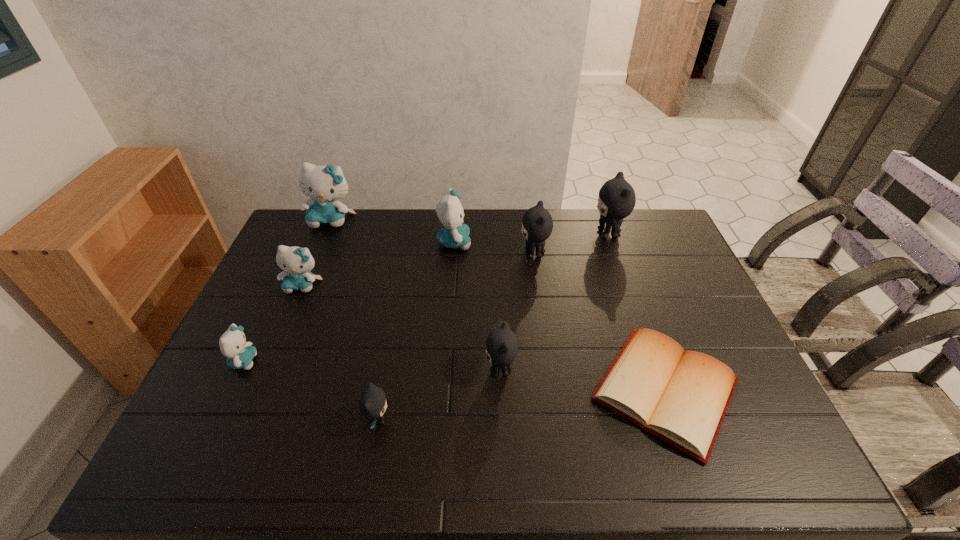
Locate an element on the screen. free spot that satisfies the following two spatial constraints: 1. on the front-facing side of the rightmost gray kitten; 2. on the face of the fourth nearest kitten is located at coordinates (626, 286).

Find the location of `vacant space that satisfies the following two spatial constraints: 1. on the face of the second nearest blue kitten; 2. on the face of the nearest blue kitten`. vacant space that satisfies the following two spatial constraints: 1. on the face of the second nearest blue kitten; 2. on the face of the nearest blue kitten is located at coordinates (271, 361).